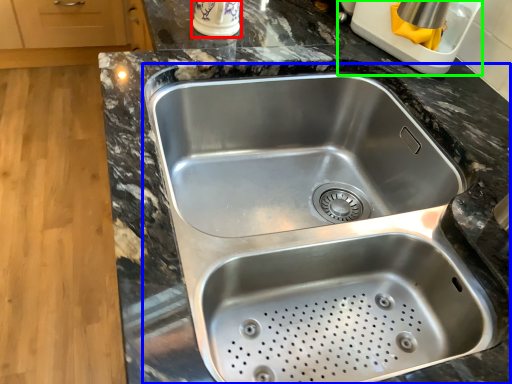
Question: Estimate the real-world distances between objects in this image. Which object is farther from appliance (highlighted by a red box), sink (highlighted by a blue box) or appliance (highlighted by a green box)?

Choices:
 (A) sink
 (B) appliance

Answer: (A)